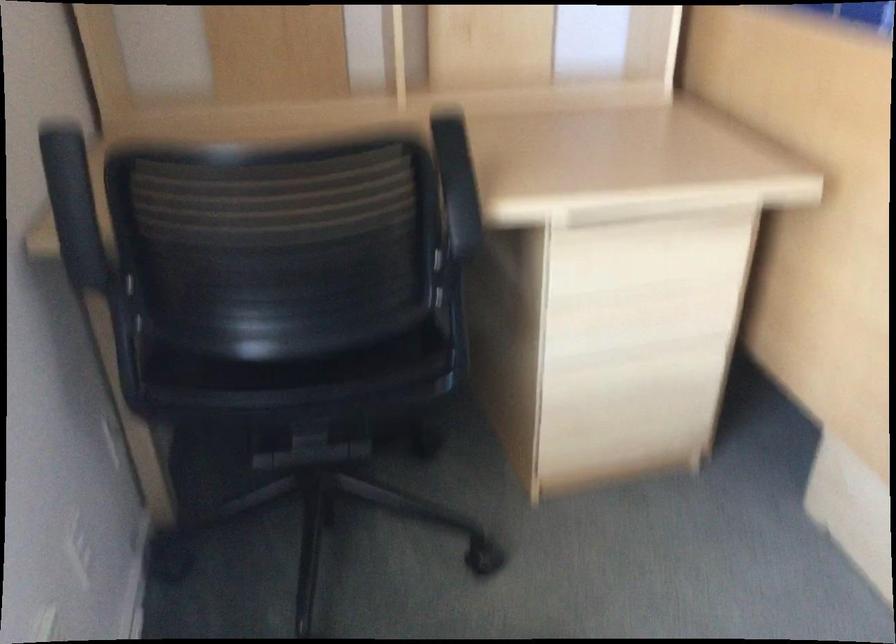
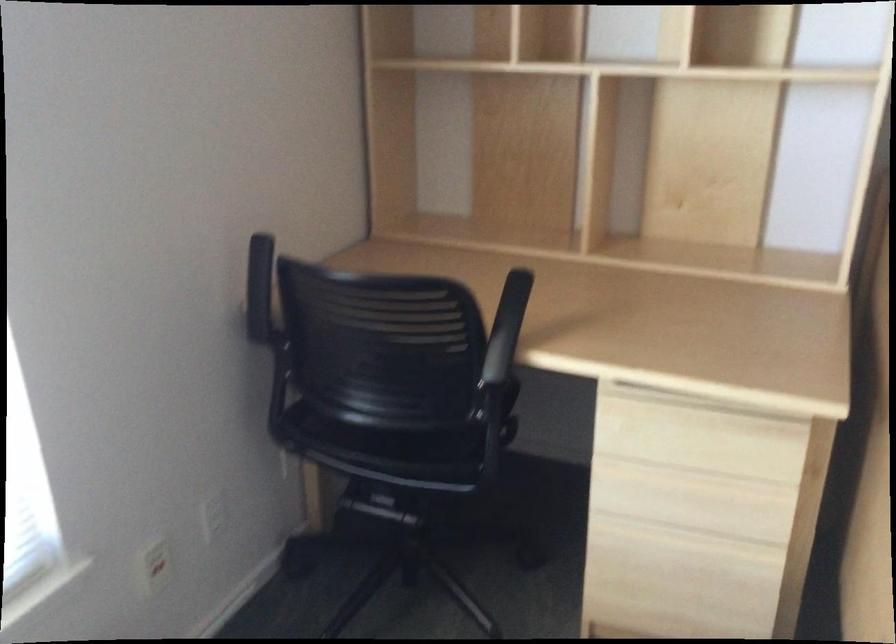
Question: The camera is either moving clockwise (left) or counter-clockwise (right) around the object. The first image is from the beginning of the video and the second image is from the end. Is the camera moving left or right when shooting the video?

Choices:
 (A) Left
 (B) Right

Answer: (B)